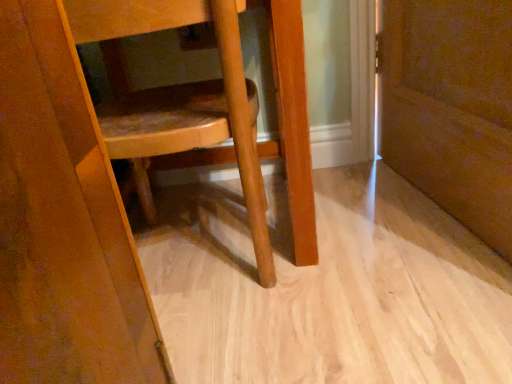
Find the location of a particular element. The height and width of the screenshot is (384, 512). wooden chair at center is located at coordinates (181, 100).

What do you see at coordinates (181, 100) in the screenshot?
I see `wooden chair at center` at bounding box center [181, 100].

In order to face wooden chair at center, should I rotate leftwards or rightwards?

You should look left and rotate roughly 11.348 degrees.

This screenshot has height=384, width=512. I want to click on wooden chair at center, so click(181, 100).